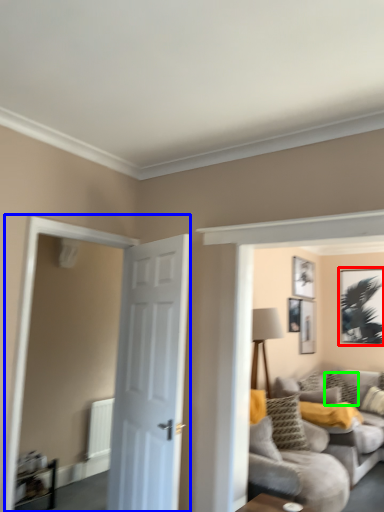
Question: Which object is the farthest from picture frame (highlighted by a red box)? Choose among these: glass door (highlighted by a blue box) or pillow (highlighted by a green box).

Choices:
 (A) glass door
 (B) pillow

Answer: (A)